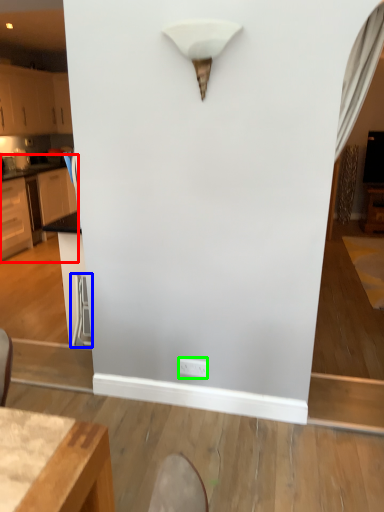
Question: Which object is positioned farthest from cabinetry (highlighted by a red box)? Select from swivel chair (highlighted by a blue box) and electric outlet (highlighted by a green box).

Choices:
 (A) swivel chair
 (B) electric outlet

Answer: (B)